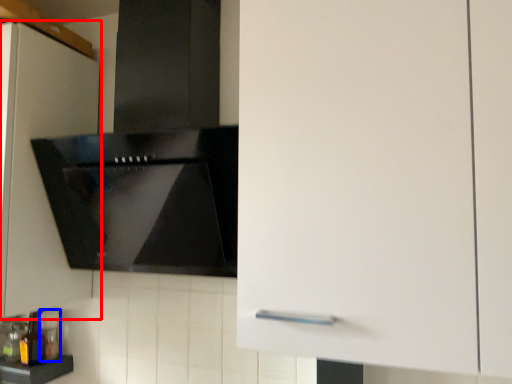
Question: Which object is further to the camera taking this photo, cabinetry (highlighted by a red box) or bottle (highlighted by a blue box)?

Choices:
 (A) cabinetry
 (B) bottle

Answer: (B)